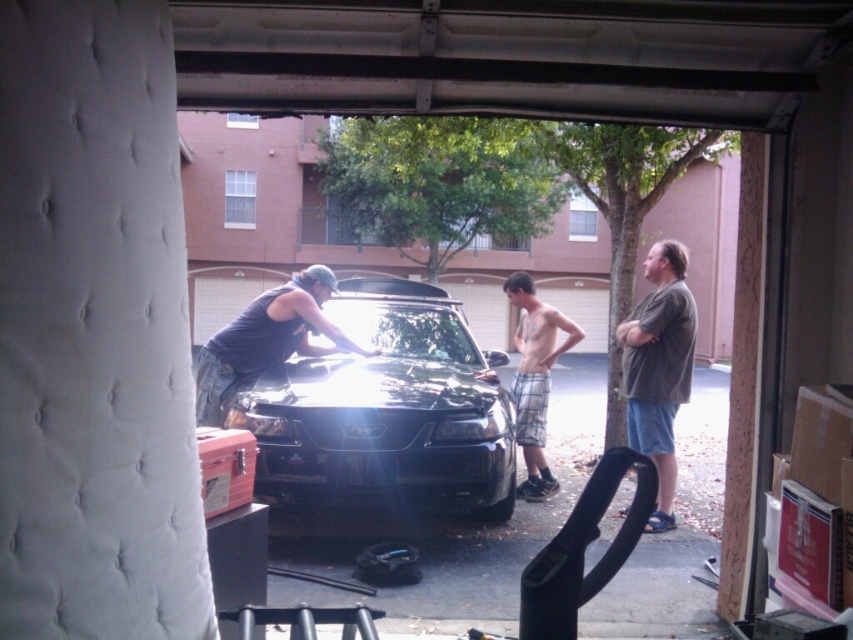
You are standing inside the garage and want to move from point A to point B. Point A is located at coordinates point (670, 390) and point B is at point (525, 420). Based on the scene description, will you have to walk forward or backward to reach point B from point A?

Based on the coordinates provided, point (670, 390) is in front of point (525, 420). Therefore, to move from point A to point B, you would need to walk backward since point B is behind point A.